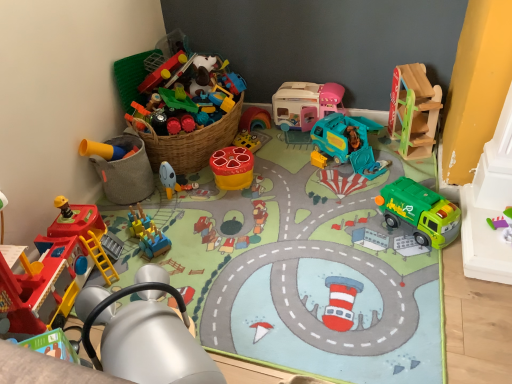
Question: Is matte plastic toy at center, the 7th toy viewed from the right, located within yellow matte bucket at lower left, the first toy in the left-to-right sequence?

Choices:
 (A) yes
 (B) no

Answer: (B)

Question: Does yellow matte bucket at lower left, the 9th toy when ordered from right to left, have a greater width compared to matte plastic toy at center, which is the 3th toy in left-to-right order?

Choices:
 (A) yes
 (B) no

Answer: (A)

Question: From the image's perspective, is yellow matte bucket at lower left, the 9th toy when ordered from right to left, over matte plastic toy at center, which is the 3th toy in left-to-right order?

Choices:
 (A) no
 (B) yes

Answer: (B)

Question: Is yellow matte bucket at lower left, the first toy in the left-to-right sequence, bigger than matte plastic toy at center, the 7th toy viewed from the right?

Choices:
 (A) yes
 (B) no

Answer: (A)

Question: Is yellow matte bucket at lower left, the first toy in the left-to-right sequence, oriented away from matte plastic toy at center, the 7th toy viewed from the right?

Choices:
 (A) no
 (B) yes

Answer: (A)

Question: Is yellow matte bucket at lower left, the first toy in the left-to-right sequence, behind matte plastic toy at center, the 7th toy viewed from the right?

Choices:
 (A) no
 (B) yes

Answer: (A)

Question: Is blue plastic train at center, acting as the 8th toy starting from the right, with wooden slide at upper right, marked as the ninth toy in a left-to-right arrangement?

Choices:
 (A) no
 (B) yes

Answer: (A)

Question: Is blue plastic train at center, which appears as the 2th toy when viewed from the left, thinner than wooden slide at upper right, marked as the ninth toy in a left-to-right arrangement?

Choices:
 (A) yes
 (B) no

Answer: (A)

Question: Does blue plastic train at center, which appears as the 2th toy when viewed from the left, have a greater width compared to wooden slide at upper right, marked as the 1th toy in a right-to-left arrangement?

Choices:
 (A) yes
 (B) no

Answer: (B)

Question: Is blue plastic train at center, which appears as the 2th toy when viewed from the left, outside of wooden slide at upper right, marked as the ninth toy in a left-to-right arrangement?

Choices:
 (A) yes
 (B) no

Answer: (A)

Question: From a real-world perspective, is blue plastic train at center, which appears as the 2th toy when viewed from the left, under wooden slide at upper right, marked as the ninth toy in a left-to-right arrangement?

Choices:
 (A) no
 (B) yes

Answer: (B)

Question: Is blue plastic train at center, which appears as the 2th toy when viewed from the left, facing away from wooden slide at upper right, marked as the ninth toy in a left-to-right arrangement?

Choices:
 (A) no
 (B) yes

Answer: (A)

Question: Considering the relative positions of green plastic garbage truck at lower right, which appears as the second toy when viewed from the right, and wooden slide at upper right, marked as the 1th toy in a right-to-left arrangement, in the image provided, is green plastic garbage truck at lower right, which appears as the second toy when viewed from the right, behind wooden slide at upper right, marked as the 1th toy in a right-to-left arrangement,?

Choices:
 (A) no
 (B) yes

Answer: (A)